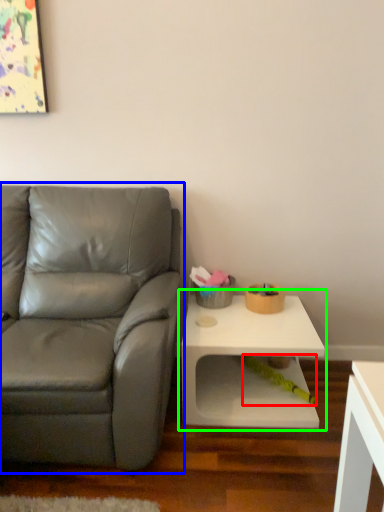
Question: Based on their relative distances, which object is nearer to toy (highlighted by a red box)? Choose from studio couch (highlighted by a blue box) and table (highlighted by a green box).

Choices:
 (A) studio couch
 (B) table

Answer: (B)